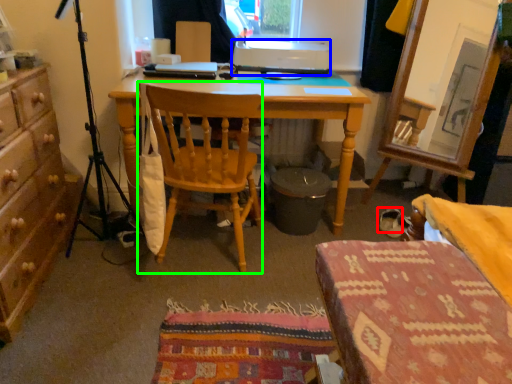
Question: Considering the real-world distances, which object is farthest from footwear (highlighted by a red box)? printer (highlighted by a blue box) or chair (highlighted by a green box)?

Choices:
 (A) printer
 (B) chair

Answer: (A)